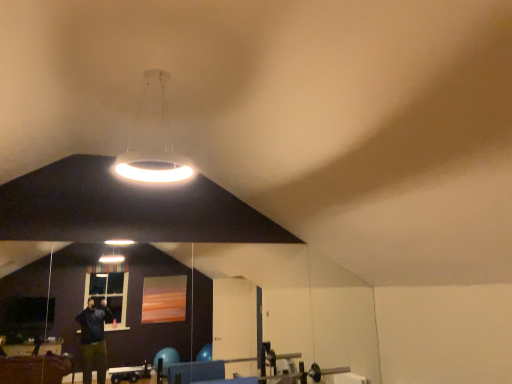
Where is `white glossy ring light at upper center`? The image size is (512, 384). white glossy ring light at upper center is located at coordinates (154, 152).

The image size is (512, 384). What do you see at coordinates (154, 152) in the screenshot?
I see `white glossy ring light at upper center` at bounding box center [154, 152].

Locate an element on the screen. Image resolution: width=512 pixels, height=384 pixels. white glossy ring light at upper center is located at coordinates (154, 152).